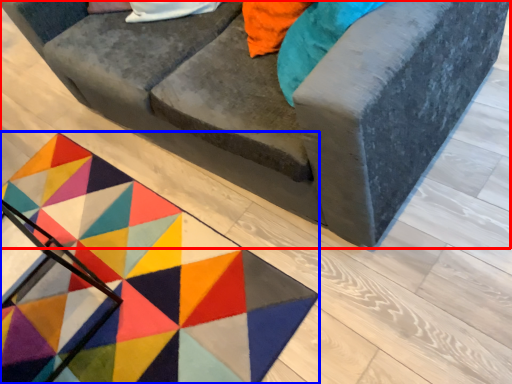
Question: Which point is further to the camera, studio couch (highlighted by a red box) or mat (highlighted by a blue box)?

Choices:
 (A) studio couch
 (B) mat

Answer: (B)